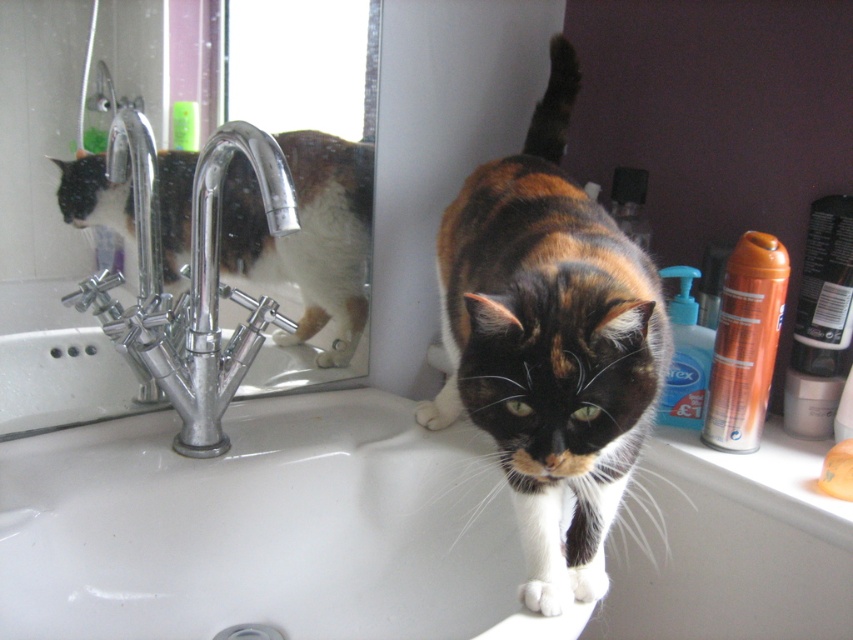
Question: Does calico fur cat at center come behind chrome metallic faucet at sink left?

Choices:
 (A) yes
 (B) no

Answer: (B)

Question: Is silver/metallic mirror at upper center wider than chrome metallic faucet at sink left?

Choices:
 (A) yes
 (B) no

Answer: (A)

Question: Which point is farther to the camera?

Choices:
 (A) (444, 348)
 (B) (193, 192)
 (C) (97, 371)
 (D) (79, 609)

Answer: (A)

Question: Is silver/metallic mirror at upper center below calico fur cat at center?

Choices:
 (A) yes
 (B) no

Answer: (B)

Question: Which object appears closest to the camera in this image?

Choices:
 (A) chrome metallic faucet at sink left
 (B) calico fur cat at center

Answer: (B)

Question: Which object is farther from the camera taking this photo?

Choices:
 (A) calico fur cat at center
 (B) white glossy sink at center
 (C) chrome metallic faucet at sink left
 (D) silver/metallic mirror at upper center

Answer: (D)